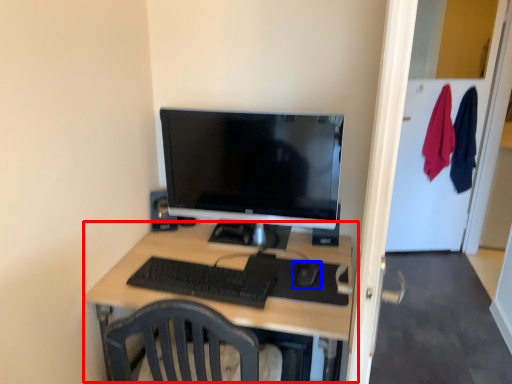
Question: Which object is closer to the camera taking this photo, desk (highlighted by a red box) or mouse (highlighted by a blue box)?

Choices:
 (A) desk
 (B) mouse

Answer: (A)